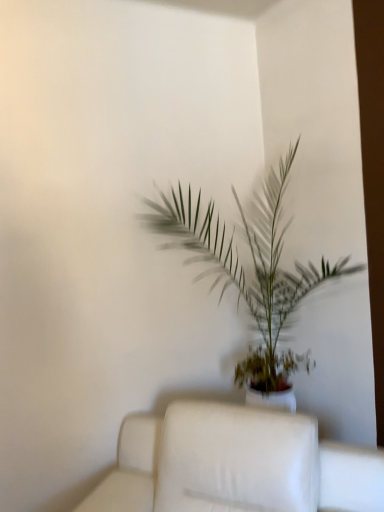
What do you see at coordinates (254, 272) in the screenshot?
I see `green leafy plant at center` at bounding box center [254, 272].

Consider the image. What is the approximate height of green leafy plant at center?

green leafy plant at center is 1.85 meters tall.

I want to click on green leafy plant at center, so click(x=254, y=272).

The height and width of the screenshot is (512, 384). What do you see at coordinates (235, 464) in the screenshot?
I see `white fabric couch at center` at bounding box center [235, 464].

At what (x,y) coordinates should I click in order to perform the action: click on white fabric couch at center. Please return your answer as a coordinate pair (x, y). This screenshot has width=384, height=512. Looking at the image, I should click on (235, 464).

You are a GUI agent. You are given a task and a screenshot of the screen. Output one action in this format:
    pyautogui.click(x=<x>, y=<y>)
    Task: Click on the green leafy plant at center
    
    Given the screenshot: What is the action you would take?
    254,272

Based on their positions, is green leafy plant at center located to the left or right of white fabric couch at center?

From the image, it's evident that green leafy plant at center is to the right of white fabric couch at center.

Which is behind, green leafy plant at center or white fabric couch at center?

green leafy plant at center.

Does point (275, 223) come closer to viewer compared to point (224, 496)?

No, it is not.

From the image's perspective, who appears lower, green leafy plant at center or white fabric couch at center?

white fabric couch at center.

From a real-world perspective, is green leafy plant at center below white fabric couch at center?

No, from a real-world perspective, green leafy plant at center is not beneath white fabric couch at center.

Can you confirm if green leafy plant at center is thinner than white fabric couch at center?

Correct, the width of green leafy plant at center is less than that of white fabric couch at center.

Looking at this image, does green leafy plant at center have a lesser height compared to white fabric couch at center?

In fact, green leafy plant at center may be taller than white fabric couch at center.

Is green leafy plant at center smaller than white fabric couch at center?

No, green leafy plant at center is not smaller than white fabric couch at center.

Which is correct: green leafy plant at center is inside white fabric couch at center, or outside of it?

green leafy plant at center is not enclosed by white fabric couch at center.

Is green leafy plant at center directly adjacent to white fabric couch at center?

No, green leafy plant at center is not next to white fabric couch at center.

Is green leafy plant at center oriented towards white fabric couch at center?

Yes, green leafy plant at center is turned towards white fabric couch at center.

Measure the distance between green leafy plant at center and white fabric couch at center.

They are 63.14 centimeters apart.

Where is `furniture in front of the green leafy plant at center`? This screenshot has height=512, width=384. furniture in front of the green leafy plant at center is located at coordinates (x=235, y=464).

Considering the relative positions of white fabric couch at center and green leafy plant at center in the image provided, is white fabric couch at center to the right of green leafy plant at center from the viewer's perspective?

No.

Which object is more forward, white fabric couch at center or green leafy plant at center?

white fabric couch at center is more forward.

Considering the positions of points (320, 455) and (295, 283), is point (320, 455) closer to camera compared to point (295, 283)?

Yes, it is in front of point (295, 283).

From the image's perspective, is white fabric couch at center on top of green leafy plant at center?

No, from the image's perspective, white fabric couch at center is not above green leafy plant at center.

From a real-world perspective, is white fabric couch at center on top of green leafy plant at center?

No, from a real-world perspective, white fabric couch at center is not on top of green leafy plant at center.

Based on the photo, does white fabric couch at center have a greater width compared to green leafy plant at center?

Indeed, white fabric couch at center has a greater width compared to green leafy plant at center.

Who is taller, white fabric couch at center or green leafy plant at center?

With more height is green leafy plant at center.

Considering the relative sizes of white fabric couch at center and green leafy plant at center in the image provided, is white fabric couch at center smaller than green leafy plant at center?

Indeed, white fabric couch at center has a smaller size compared to green leafy plant at center.

Would you say white fabric couch at center is inside or outside green leafy plant at center?

white fabric couch at center exists outside the volume of green leafy plant at center.

Is white fabric couch at center next to green leafy plant at center?

No, white fabric couch at center is not beside green leafy plant at center.

Is white fabric couch at center positioned with its back to green leafy plant at center?

Yes, white fabric couch at center is facing away from green leafy plant at center.

Can you tell me how much white fabric couch at center and green leafy plant at center differ in facing direction?

The facing directions of white fabric couch at center and green leafy plant at center are 36.6 degrees apart.

You are a GUI agent. You are given a task and a screenshot of the screen. Output one action in this format:
    pyautogui.click(x=<x>, y=<y>)
    Task: Click on the furniture below the green leafy plant at center (from the image's perspective)
    The width and height of the screenshot is (384, 512).
    Given the screenshot: What is the action you would take?
    pyautogui.click(x=235, y=464)

The height and width of the screenshot is (512, 384). I want to click on furniture in front of the green leafy plant at center, so click(x=235, y=464).

Locate an element on the screen. furniture located underneath the green leafy plant at center (from a real-world perspective) is located at coordinates (235, 464).